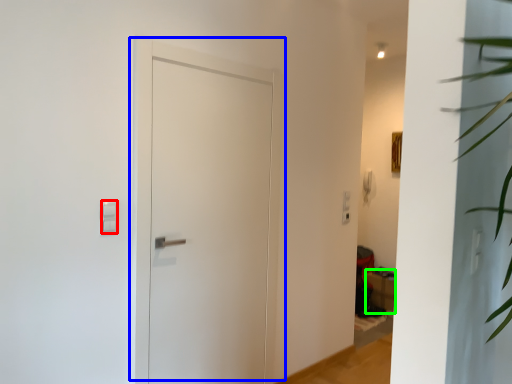
Question: Which object is positioned closest to light switch (highlighted by a red box)? Select from door (highlighted by a blue box) and furniture (highlighted by a green box).

Choices:
 (A) door
 (B) furniture

Answer: (A)